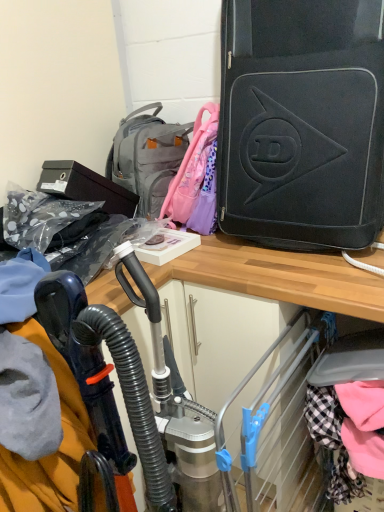
Find the location of a particular element. gray fabric backpack at upper center is located at coordinates (147, 157).

In order to face black matte suitcase at upper right, should I rotate leftwards or rightwards?

To align with it, rotate right about 15.811°.

Describe the element at coordinates (176, 404) in the screenshot. The height and width of the screenshot is (512, 384). I see `metallic silver vacuum cleaner at center` at that location.

Locate an element on the screen. The image size is (384, 512). gray fabric backpack at upper center is located at coordinates (147, 157).

Can you tell me how much black matte suitcase at upper right and metallic silver vacuum cleaner at center differ in facing direction?

They differ by 82.1 degrees in their facing directions.

From the image's perspective, between black matte suitcase at upper right and metallic silver vacuum cleaner at center, which one is located above?

black matte suitcase at upper right.

Considering the sizes of black matte suitcase at upper right and metallic silver vacuum cleaner at center in the image, is black matte suitcase at upper right wider or thinner than metallic silver vacuum cleaner at center?

In the image, black matte suitcase at upper right appears to be wider than metallic silver vacuum cleaner at center.

Between metallic silver vacuum cleaner at center and black matte suitcase at upper right, which one has smaller width?

metallic silver vacuum cleaner at center.

Measure the distance from metallic silver vacuum cleaner at center to black matte suitcase at upper right.

A distance of 60.65 centimeters exists between metallic silver vacuum cleaner at center and black matte suitcase at upper right.

Which object is further away from the camera taking this photo, metallic silver vacuum cleaner at center or black matte suitcase at upper right?

black matte suitcase at upper right is further away from the camera.

Is metallic silver vacuum cleaner at center positioned far away from black matte suitcase at upper right?

No.

Does gray fabric backpack at upper center turn towards black matte suitcase at upper right?

No, gray fabric backpack at upper center is not turned towards black matte suitcase at upper right.

Considering the positions of points (140, 122) and (225, 68), is point (140, 122) closer to camera compared to point (225, 68)?

No, it is not.

Considering the sizes of objects gray fabric backpack at upper center and black matte suitcase at upper right in the image provided, who is thinner, gray fabric backpack at upper center or black matte suitcase at upper right?

With smaller width is gray fabric backpack at upper center.

Is gray fabric backpack at upper center looking in the opposite direction of metallic silver vacuum cleaner at center?

No, metallic silver vacuum cleaner at center is not at the back of gray fabric backpack at upper center.

Would you say metallic silver vacuum cleaner at center is part of gray fabric backpack at upper center's contents?

That's incorrect, metallic silver vacuum cleaner at center is not inside gray fabric backpack at upper center.

What are the coordinates of `sport equipment that appears on the right of gray fabric backpack at upper center` in the screenshot? It's located at (176, 404).

Considering the sizes of objects gray fabric backpack at upper center and metallic silver vacuum cleaner at center in the image provided, who is shorter, gray fabric backpack at upper center or metallic silver vacuum cleaner at center?

Standing shorter between the two is gray fabric backpack at upper center.

Looking at this image, is black matte suitcase at upper right not inside gray fabric backpack at upper center?

Yes.

Which of these two, black matte suitcase at upper right or gray fabric backpack at upper center, is bigger?

black matte suitcase at upper right is bigger.

Considering the relative positions of black matte suitcase at upper right and gray fabric backpack at upper center in the image provided, is black matte suitcase at upper right to the left of gray fabric backpack at upper center from the viewer's perspective?

No.

From a real-world perspective, is black matte suitcase at upper right above or below gray fabric backpack at upper center?

From a real-world perspective, black matte suitcase at upper right is physically above gray fabric backpack at upper center.

Can you confirm if metallic silver vacuum cleaner at center is smaller than gray fabric backpack at upper center?

No, metallic silver vacuum cleaner at center is not smaller than gray fabric backpack at upper center.

Can you tell me how much metallic silver vacuum cleaner at center and gray fabric backpack at upper center differ in facing direction?

95.2 degrees separate the facing orientations of metallic silver vacuum cleaner at center and gray fabric backpack at upper center.

Does metallic silver vacuum cleaner at center turn towards gray fabric backpack at upper center?

No, metallic silver vacuum cleaner at center is not oriented towards gray fabric backpack at upper center.

From a real-world perspective, relative to gray fabric backpack at upper center, is metallic silver vacuum cleaner at center vertically above or below?

From a real-world perspective, metallic silver vacuum cleaner at center is physically below gray fabric backpack at upper center.

At what (x,y) coordinates should I click in order to perform the action: click on luggage and bags lying above the metallic silver vacuum cleaner at center (from the image's perspective). Please return your answer as a coordinate pair (x, y). Looking at the image, I should click on (302, 123).

Find the location of a particular element. This screenshot has width=384, height=512. luggage and bags on the right of metallic silver vacuum cleaner at center is located at coordinates (302, 123).

From the image, which object appears to be farther from metallic silver vacuum cleaner at center, gray fabric backpack at upper center or black matte suitcase at upper right?

Based on the image, gray fabric backpack at upper center appears to be further to metallic silver vacuum cleaner at center.

Which object lies further to the anchor point metallic silver vacuum cleaner at center, black matte suitcase at upper right or gray fabric backpack at upper center?

Among the two, gray fabric backpack at upper center is located further to metallic silver vacuum cleaner at center.

Estimate the real-world distances between objects in this image. Which object is closer to gray fabric backpack at upper center, metallic silver vacuum cleaner at center or black matte suitcase at upper right?

black matte suitcase at upper right.

Based on their spatial positions, is metallic silver vacuum cleaner at center or gray fabric backpack at upper center closer to black matte suitcase at upper right?

gray fabric backpack at upper center is closer to black matte suitcase at upper right.

Considering their positions, is gray fabric backpack at upper center positioned further to black matte suitcase at upper right than metallic silver vacuum cleaner at center?

Based on the image, metallic silver vacuum cleaner at center appears to be further to black matte suitcase at upper right.

Based on the photo, from the image, which object appears to be nearer to gray fabric backpack at upper center, black matte suitcase at upper right or metallic silver vacuum cleaner at center?

Among the two, black matte suitcase at upper right is located nearer to gray fabric backpack at upper center.

At what (x,y) coordinates should I click in order to perform the action: click on backpack between black matte suitcase at upper right and metallic silver vacuum cleaner at center from top to bottom. Please return your answer as a coordinate pair (x, y). Looking at the image, I should click on (147, 157).